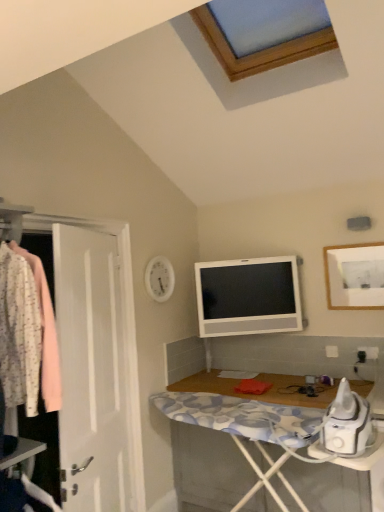
Question: Considering the positions of white matte picture frame at upper right and floral fabric shirt at left in the image, is white matte picture frame at upper right wider or thinner than floral fabric shirt at left?

Choices:
 (A) thin
 (B) wide

Answer: (A)

Question: Considering the relative positions of white matte picture frame at upper right and floral fabric shirt at left in the image provided, is white matte picture frame at upper right to the left or to the right of floral fabric shirt at left?

Choices:
 (A) left
 (B) right

Answer: (B)

Question: Which object is the closest to the white wood desk at lower right?

Choices:
 (A) floral fabric shirt at left
 (B) white glossy television at upper center
 (C) white matte picture frame at upper right

Answer: (B)

Question: Which object is positioned farthest from the white wood desk at lower right?

Choices:
 (A) white matte picture frame at upper right
 (B) white glossy television at upper center
 (C) floral fabric shirt at left

Answer: (C)